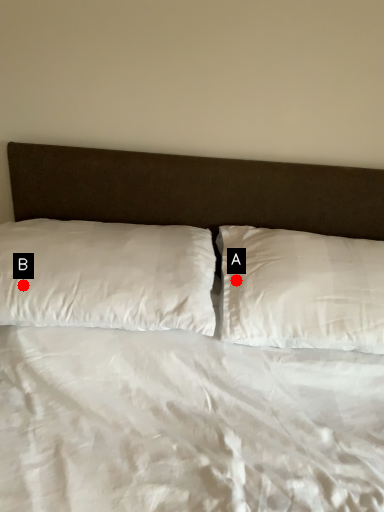
Question: Two points are circled on the image, labeled by A and B beside each circle. Among these points, which one is farthest from the camera?

Choices:
 (A) A is further
 (B) B is further

Answer: (A)